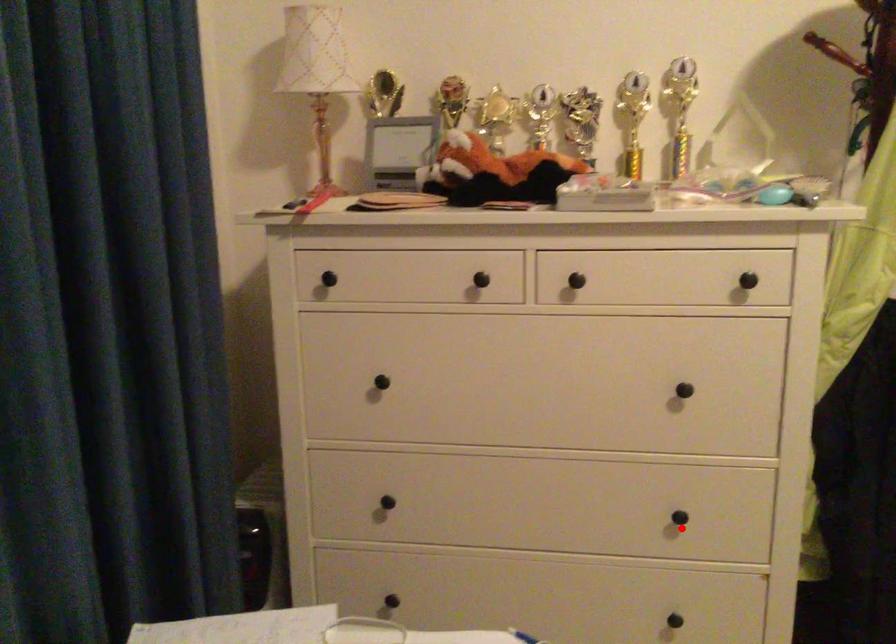
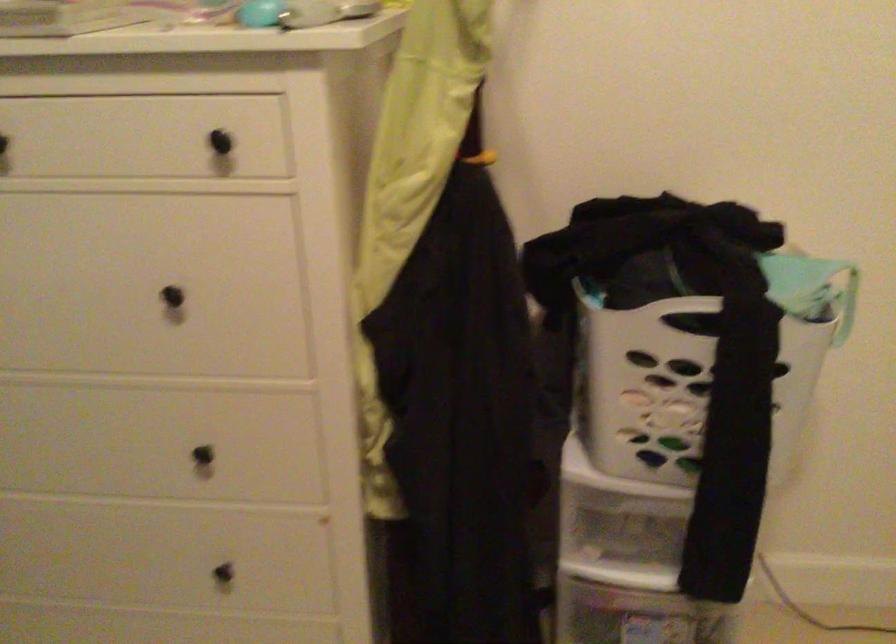
The point at the highlighted location is marked in the first image. Where is the corresponding point in the second image?

(213, 462)